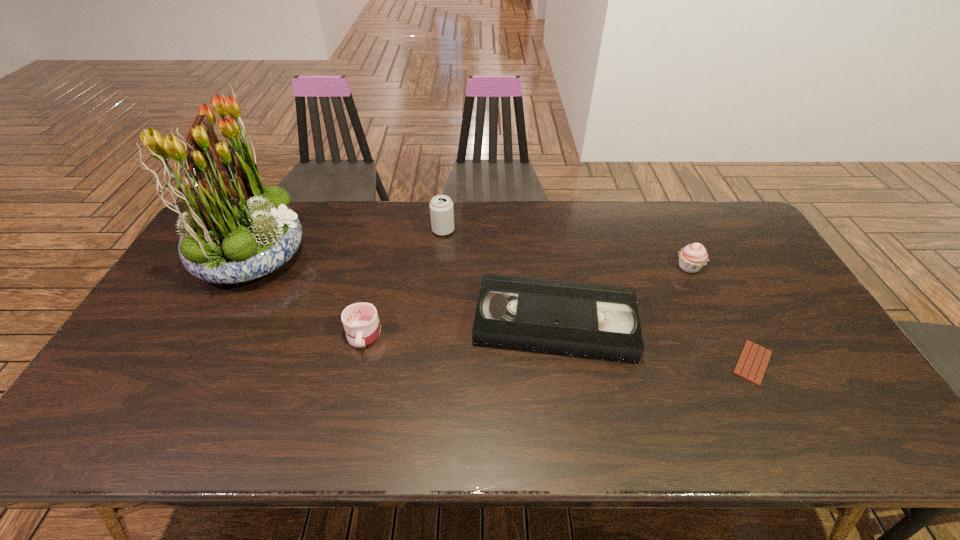
You are a GUI agent. You are given a task and a screenshot of the screen. Output one action in this format:
    pyautogui.click(x=<x>, y=<y>)
    Task: Click on the vacant region that satisfies the following two spatial constraints: 1. on the side with the handle of the third shortest object; 2. on the left side of the candy bar
    This screenshot has width=960, height=540.
    Given the screenshot: What is the action you would take?
    pyautogui.click(x=357, y=363)

You are a GUI agent. You are given a task and a screenshot of the screen. Output one action in this format:
    pyautogui.click(x=<x>, y=<y>)
    Task: Click on the vacant space that satisfies the following two spatial constraints: 1. on the front-facing side of the leftmost object; 2. on the right side of the cupcake
    This screenshot has width=960, height=540.
    Given the screenshot: What is the action you would take?
    pyautogui.click(x=246, y=267)